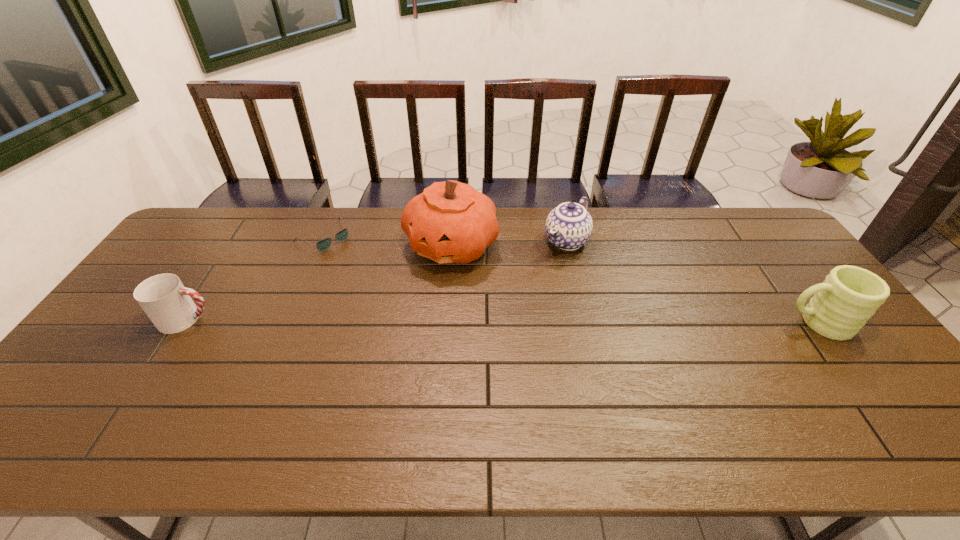
Locate an element on the screen. This screenshot has height=540, width=960. the second shortest object is located at coordinates (165, 300).

Where is `cup`? cup is located at coordinates click(165, 300).

Identify the location of mug. (848, 297).

Where is `chinaware`? The image size is (960, 540). chinaware is located at coordinates (569, 226).

Locate an element on the screen. The width and height of the screenshot is (960, 540). the third object from left to right is located at coordinates (451, 222).

Where is `pumpkin`? pumpkin is located at coordinates (451, 222).

Find the location of `sunglasses`. sunglasses is located at coordinates (323, 245).

Where is `the second object from left to right`? the second object from left to right is located at coordinates click(323, 245).

Identify the location of blank space located on the side of the leftmost object where the handle is located. This screenshot has width=960, height=540. (253, 319).

This screenshot has width=960, height=540. What are the coordinates of `vacant area situated on the side of the mug with the handle` in the screenshot? It's located at (638, 323).